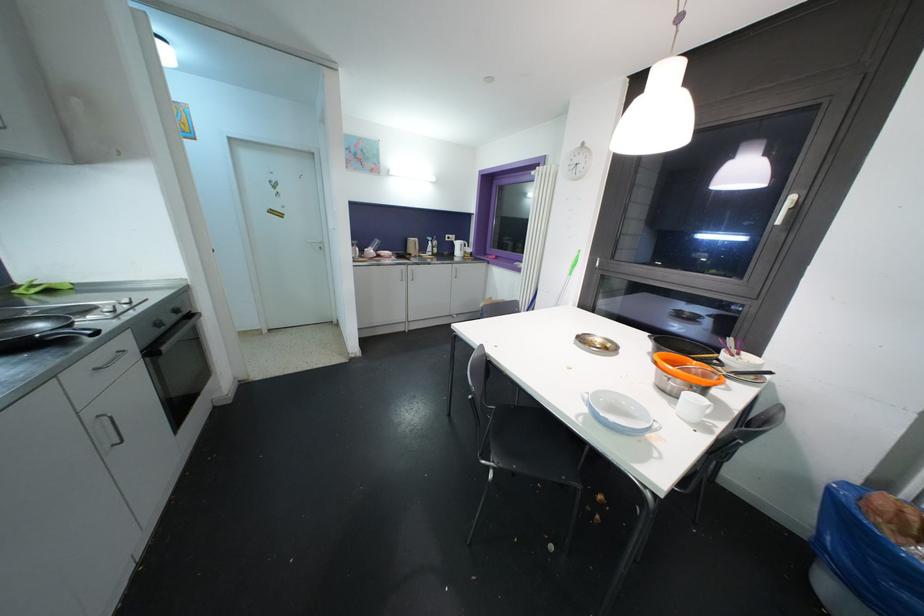
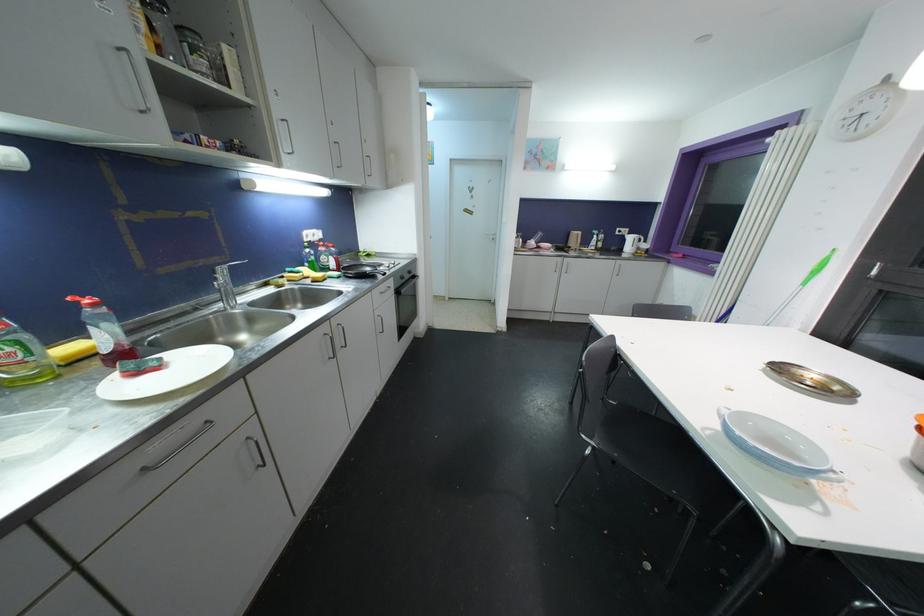
The point at (593, 395) is marked in the first image. Where is the corresponding point in the second image?

(737, 411)